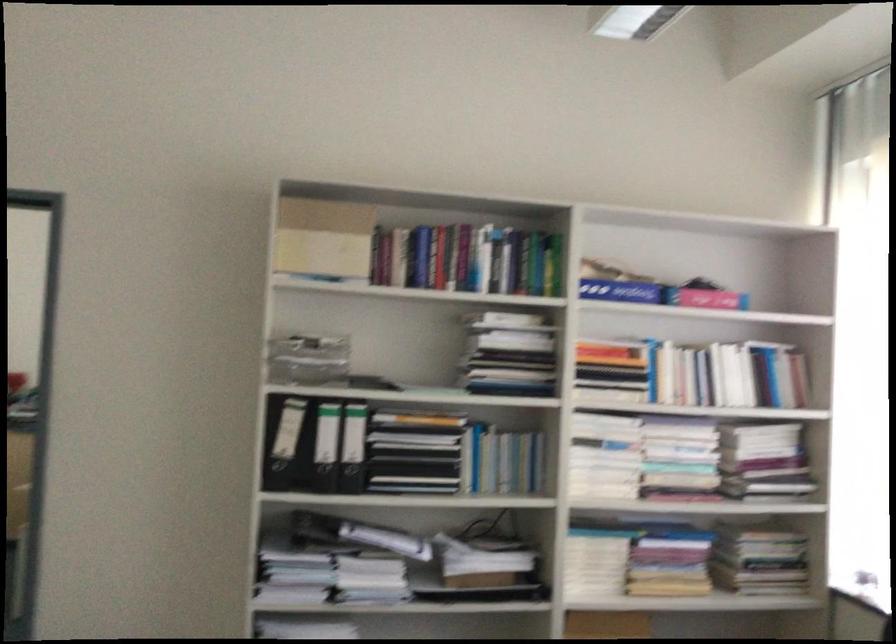
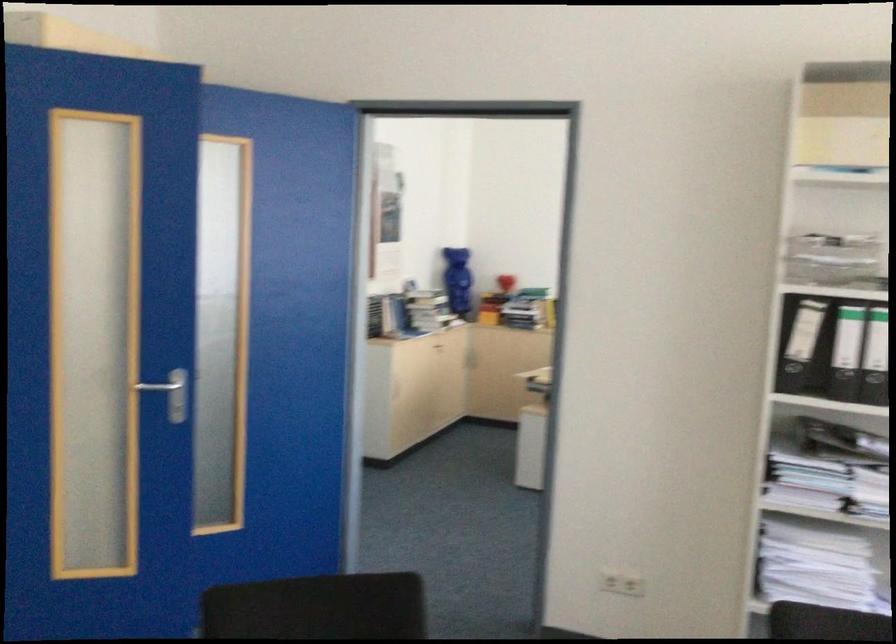
Question: The camera is either moving clockwise (left) or counter-clockwise (right) around the object. The first image is from the beginning of the video and the second image is from the end. Is the camera moving left or right when shooting the video?

Choices:
 (A) Left
 (B) Right

Answer: (B)